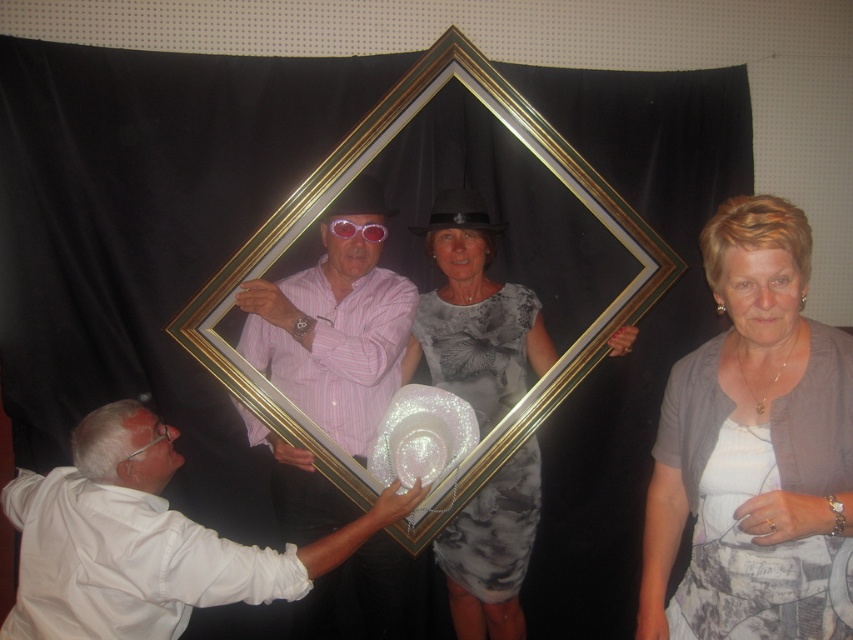
Question: Can you confirm if gold metallic picture frame at center is positioned below pink striped shirt at center?

Choices:
 (A) no
 (B) yes

Answer: (A)

Question: Based on their relative distances, which object is farther from the pink striped shirt at center?

Choices:
 (A) gold metallic picture frame at center
 (B) white matte hat at lower left

Answer: (B)

Question: Can you confirm if gray textured cardigan at center is positioned to the right of pink striped shirt at center?

Choices:
 (A) no
 (B) yes

Answer: (B)

Question: Which of the following is the closest to the observer?

Choices:
 (A) white matte hat at lower left
 (B) gray textured dress at center
 (C) pink striped shirt at center
 (D) gold metallic picture frame at center

Answer: (A)

Question: Which of the following is the closest to the observer?

Choices:
 (A) gold metallic picture frame at center
 (B) gray textured dress at center
 (C) pink striped shirt at center

Answer: (C)

Question: Is gold metallic picture frame at center to the right of gray textured dress at center from the viewer's perspective?

Choices:
 (A) yes
 (B) no

Answer: (B)